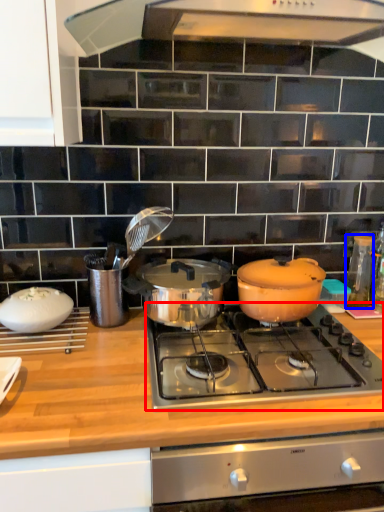
Question: Which object is further to the camera taking this photo, gas stove (highlighted by a red box) or kitchen appliance (highlighted by a blue box)?

Choices:
 (A) gas stove
 (B) kitchen appliance

Answer: (B)